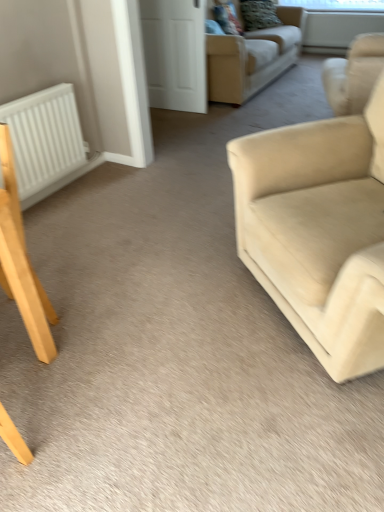
Question: Is beige fabric couch at upper center, which is the second studio couch in bottom-to-top order, not inside transparent plastic window screen at upper center, which is the second window screen from bottom to top?

Choices:
 (A) yes
 (B) no

Answer: (A)

Question: Is the depth of beige fabric couch at upper center, which is the second studio couch in bottom-to-top order, greater than that of transparent plastic window screen at upper center, marked as the 1th window screen in a top-to-bottom arrangement?

Choices:
 (A) no
 (B) yes

Answer: (A)

Question: From a real-world perspective, is beige fabric couch at upper center, which appears as the first studio couch when viewed from the top, positioned over transparent plastic window screen at upper center, marked as the 1th window screen in a top-to-bottom arrangement, based on gravity?

Choices:
 (A) no
 (B) yes

Answer: (A)

Question: Can you confirm if beige fabric couch at upper center, marked as the first studio couch in a back-to-front arrangement, is taller than transparent plastic window screen at upper center, marked as the 1th window screen in a top-to-bottom arrangement?

Choices:
 (A) yes
 (B) no

Answer: (A)

Question: Is beige fabric couch at upper center, which is the second studio couch in bottom-to-top order, oriented towards transparent plastic window screen at upper center, marked as the 1th window screen in a top-to-bottom arrangement?

Choices:
 (A) no
 (B) yes

Answer: (A)

Question: In terms of size, does velvet textured pillow at upper center appear bigger or smaller than transparent plastic window screen at upper center, which is the second window screen from bottom to top?

Choices:
 (A) big
 (B) small

Answer: (A)

Question: Looking at their shapes, would you say velvet textured pillow at upper center is wider or thinner than transparent plastic window screen at upper center, marked as the 1th window screen in a top-to-bottom arrangement?

Choices:
 (A) wide
 (B) thin

Answer: (A)

Question: From the image's perspective, is velvet textured pillow at upper center located above or below transparent plastic window screen at upper center, marked as the 1th window screen in a top-to-bottom arrangement?

Choices:
 (A) above
 (B) below

Answer: (B)

Question: Does point (269, 13) appear closer or farther from the camera than point (322, 1)?

Choices:
 (A) farther
 (B) closer

Answer: (B)

Question: From their relative heights in the image, would you say velvet textured pillow at upper center is taller or shorter than beige fabric couch at upper center, which appears as the first studio couch when viewed from the top?

Choices:
 (A) tall
 (B) short

Answer: (B)

Question: Based on their positions, is velvet textured pillow at upper center located to the left or right of beige fabric couch at upper center, which appears as the first studio couch when viewed from the top?

Choices:
 (A) left
 (B) right

Answer: (B)

Question: Considering their positions, is velvet textured pillow at upper center located in front of or behind beige fabric couch at upper center, which is the second studio couch in bottom-to-top order?

Choices:
 (A) behind
 (B) front

Answer: (A)

Question: Does point (253, 3) appear closer or farther from the camera than point (256, 62)?

Choices:
 (A) farther
 (B) closer

Answer: (A)

Question: Considering the positions of point click(279, 19) and point click(148, 14), is point click(279, 19) closer or farther from the camera than point click(148, 14)?

Choices:
 (A) closer
 (B) farther

Answer: (B)

Question: Considering their positions, is velvet textured pillow at upper center located in front of or behind white matte door at upper center?

Choices:
 (A) front
 (B) behind

Answer: (B)